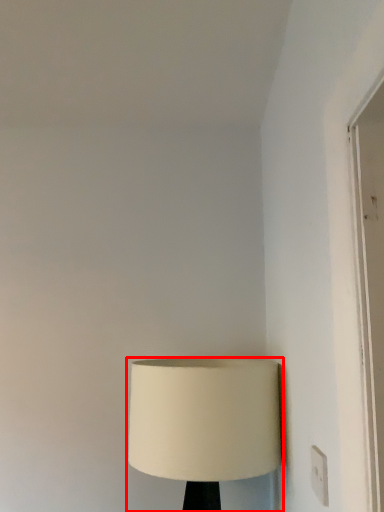
Question: From the image's perspective, what is the correct spatial positioning of lamp (annotated by the red box) in reference to electric outlet?

Choices:
 (A) above
 (B) below

Answer: (B)